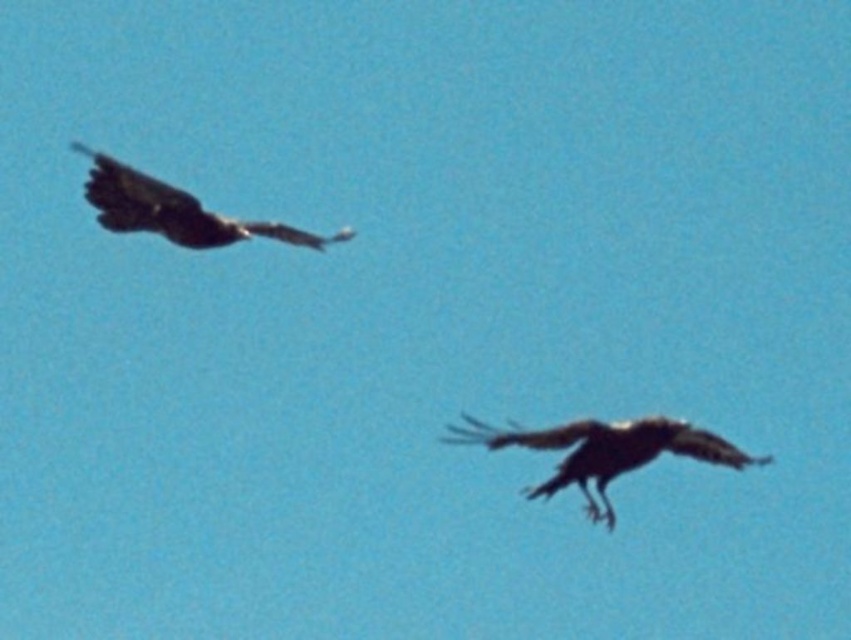
From the picture: You are a birdwatcher observing the scene. You notice the shiny black eagle at lower center and the dark brown feathers at upper left. Which of these two objects is located to the right of the other?

The shiny black eagle at lower center is positioned on the right side of dark brown feathers at upper left.

You are a birdwatcher observing two birds in the sky. You see the shiny black eagle at lower center and the dark brown feathers at upper left. Which bird is nearer to you?

The shiny black eagle at lower center is closer to the viewer than the dark brown feathers at upper left.